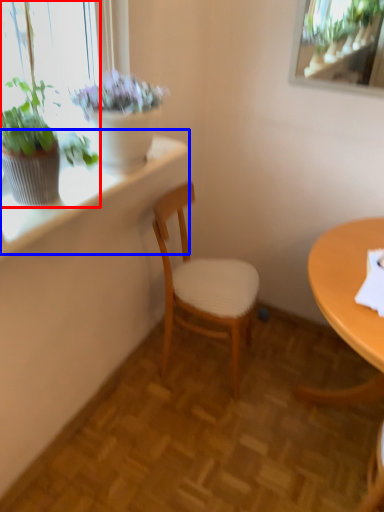
Question: Which object appears closest to the camera in this image, houseplant (highlighted by a red box) or window sill (highlighted by a blue box)?

Choices:
 (A) houseplant
 (B) window sill

Answer: (A)